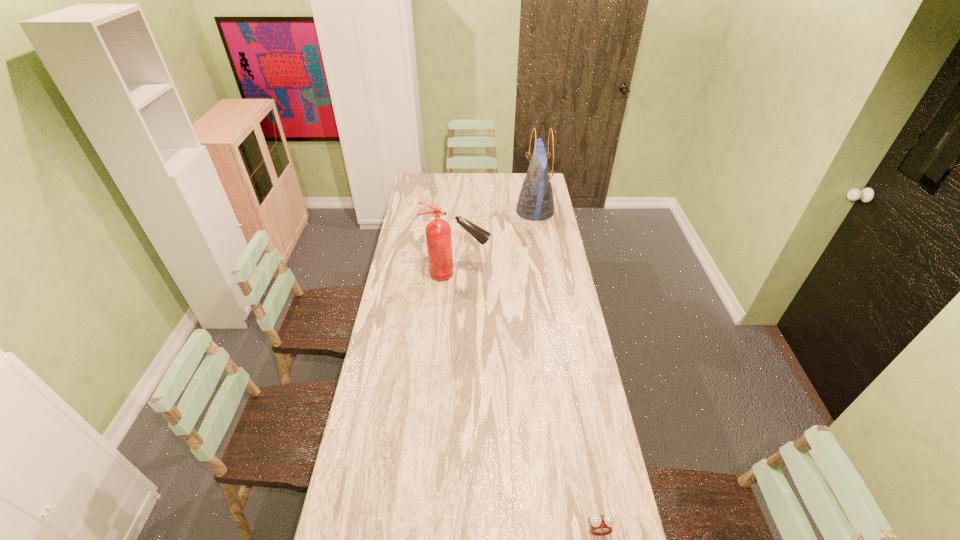
This screenshot has width=960, height=540. I want to click on shopping bag, so click(535, 202).

You are a GUI agent. You are given a task and a screenshot of the screen. Output one action in this format:
    pyautogui.click(x=<x>, y=<y>)
    Task: Click on the farthest object
    The height and width of the screenshot is (540, 960).
    Given the screenshot: What is the action you would take?
    pyautogui.click(x=535, y=202)

The image size is (960, 540). I want to click on fire extinguisher, so click(438, 231).

I want to click on the leftmost object, so point(438,231).

Where is `the shortest object`? the shortest object is located at coordinates (600, 525).

The height and width of the screenshot is (540, 960). I want to click on alarm clock, so (x=600, y=525).

Image resolution: width=960 pixels, height=540 pixels. I want to click on vacant space located on the left of the tallest object, so click(x=470, y=212).

Where is `free space located at the nozzle end of the second shortest object`? The height and width of the screenshot is (540, 960). free space located at the nozzle end of the second shortest object is located at coordinates (507, 274).

Identify the location of object that is positioned at the left edge. The width and height of the screenshot is (960, 540). (438, 231).

Locate an element on the screen. shopping bag that is positioned at the right edge is located at coordinates (535, 202).